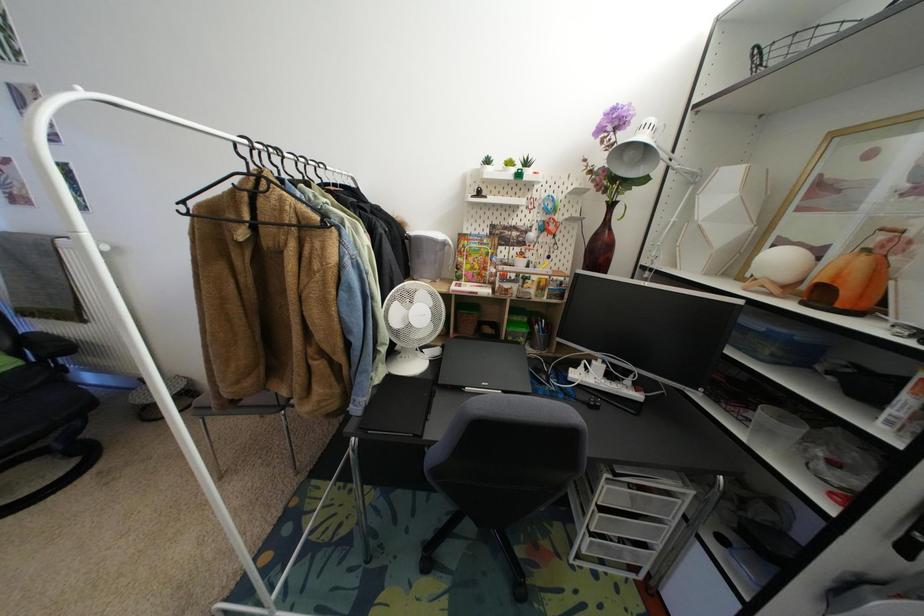
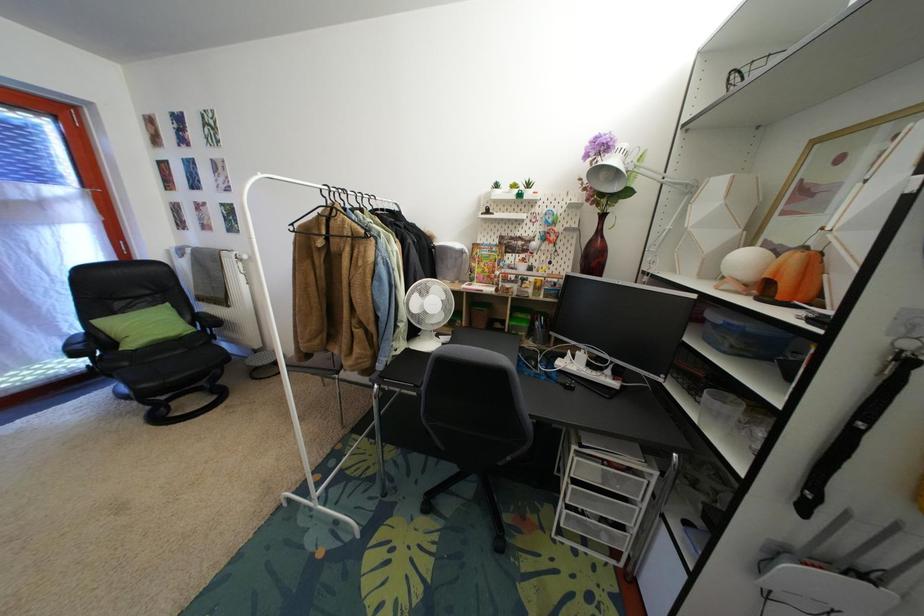
Question: The images are taken continuously from a first-person perspective. In which direction is your viewpoint rotating?

Choices:
 (A) Left
 (B) Right
 (C) Up
 (D) Down

Answer: (A)